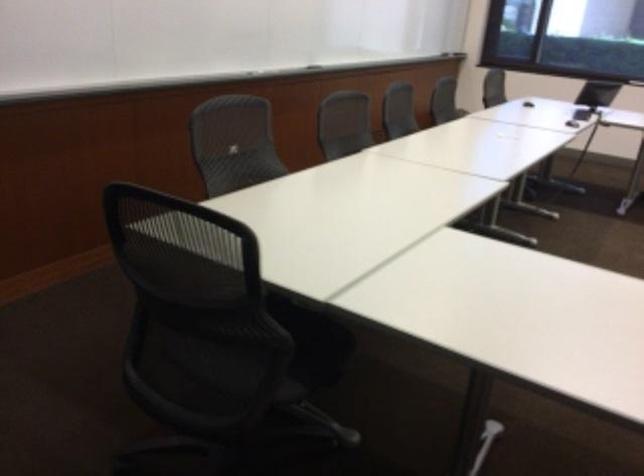
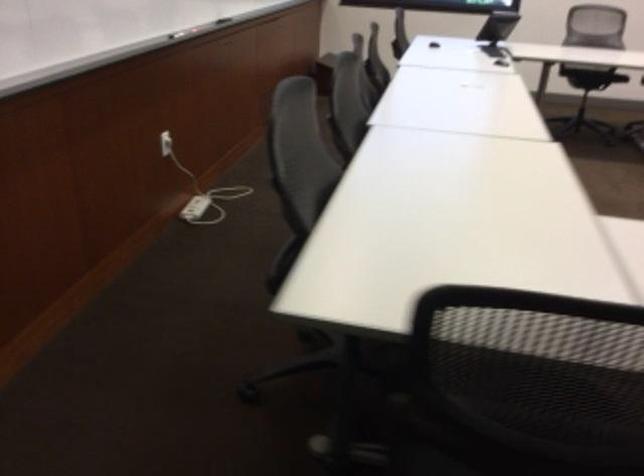
What movement of the cameraman would produce the second image?

The movement direction of the cameraman is left, forward.